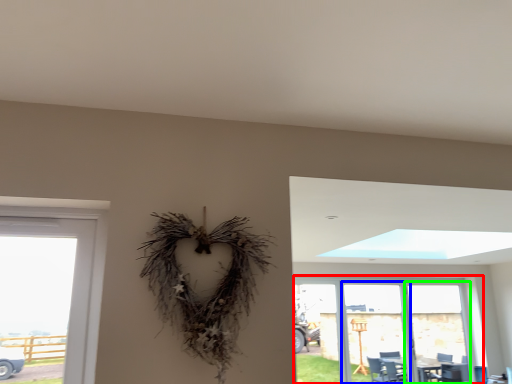
Question: Which is farther away from window (highlighted by a red box)? screen door (highlighted by a blue box) or screen door (highlighted by a green box)?

Choices:
 (A) screen door
 (B) screen door

Answer: (B)